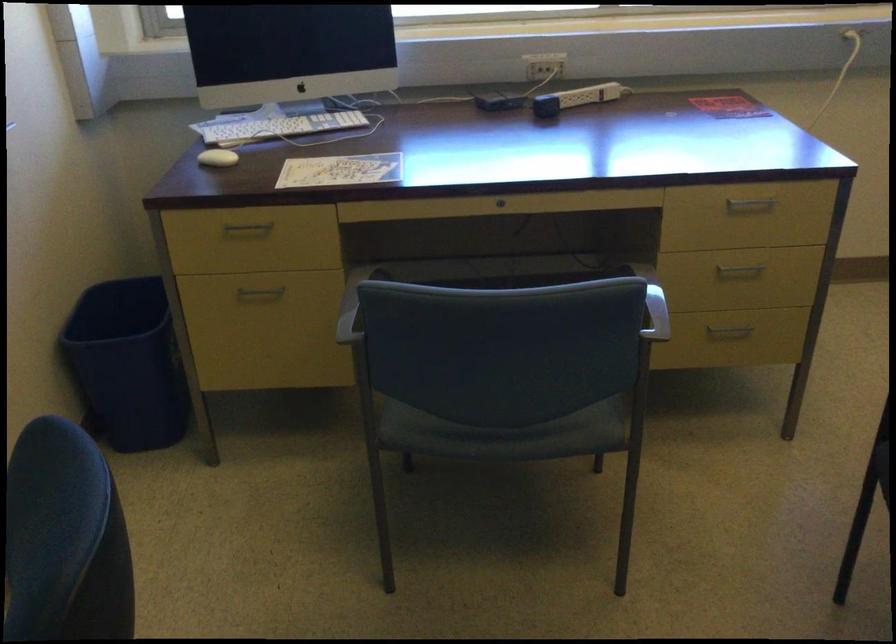
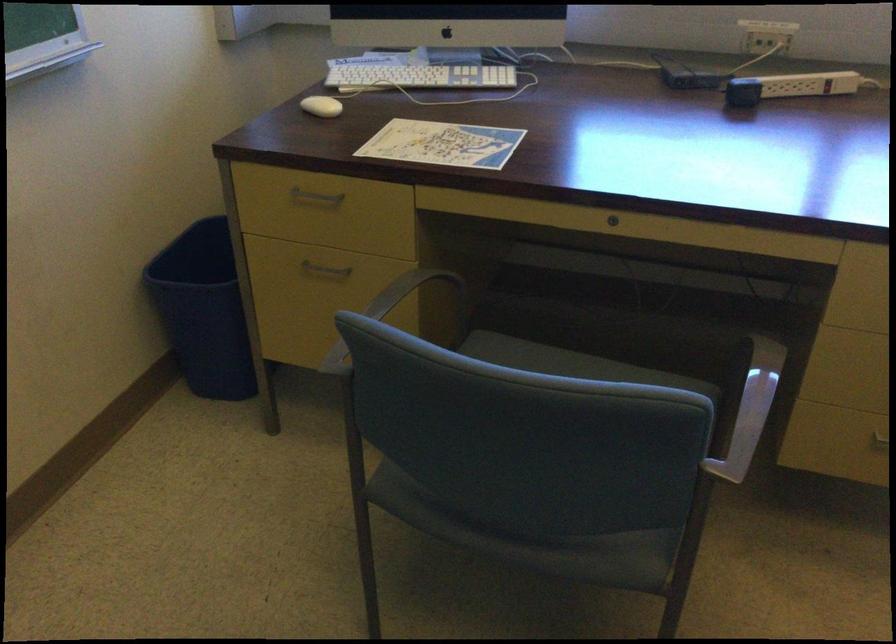
In the second image, find the point that corresponds to point 131,363 in the first image.

(202, 310)